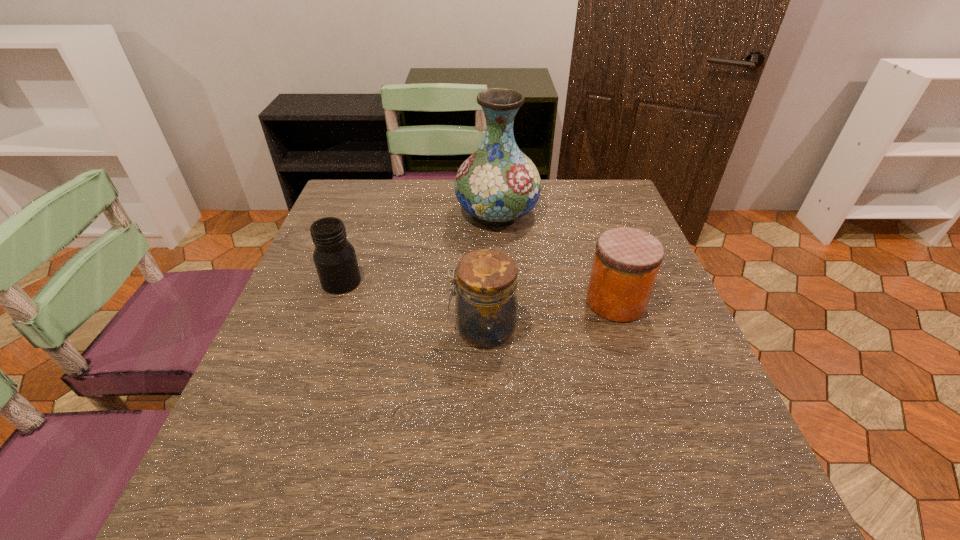
At what (x,y) coordinates should I click in order to perform the action: click on the farthest object. Please return your answer as a coordinate pair (x, y). This screenshot has height=540, width=960. Looking at the image, I should click on (498, 183).

You are a GUI agent. You are given a task and a screenshot of the screen. Output one action in this format:
    pyautogui.click(x=<x>, y=<y>)
    Task: Click on the tallest object
    The height and width of the screenshot is (540, 960).
    Given the screenshot: What is the action you would take?
    pyautogui.click(x=498, y=183)

Where is `the second jar from left to right`? the second jar from left to right is located at coordinates (486, 283).

The width and height of the screenshot is (960, 540). In order to click on the leftmost jar in this screenshot , I will do `click(334, 256)`.

Identify the location of the rightmost jar. Image resolution: width=960 pixels, height=540 pixels. (626, 263).

At what (x,y) coordinates should I click in order to perform the action: click on blank space located on the front of the farthest object. Please return your answer as a coordinate pair (x, y). Looking at the image, I should click on (499, 261).

At what (x,y) coordinates should I click in order to perform the action: click on vacant area situated 0.100m on the lid of the second jar from left to right. Please return your answer as a coordinate pair (x, y). The image size is (960, 540). Looking at the image, I should click on (401, 328).

Find the location of `free space located 0.140m on the lid of the second jar from left to right`. free space located 0.140m on the lid of the second jar from left to right is located at coordinates (382, 328).

Locate an element on the screen. The width and height of the screenshot is (960, 540). free space located 0.180m on the lid of the second jar from left to right is located at coordinates (362, 328).

In order to click on blank space located on the back of the leftmost jar in this screenshot , I will do `click(360, 228)`.